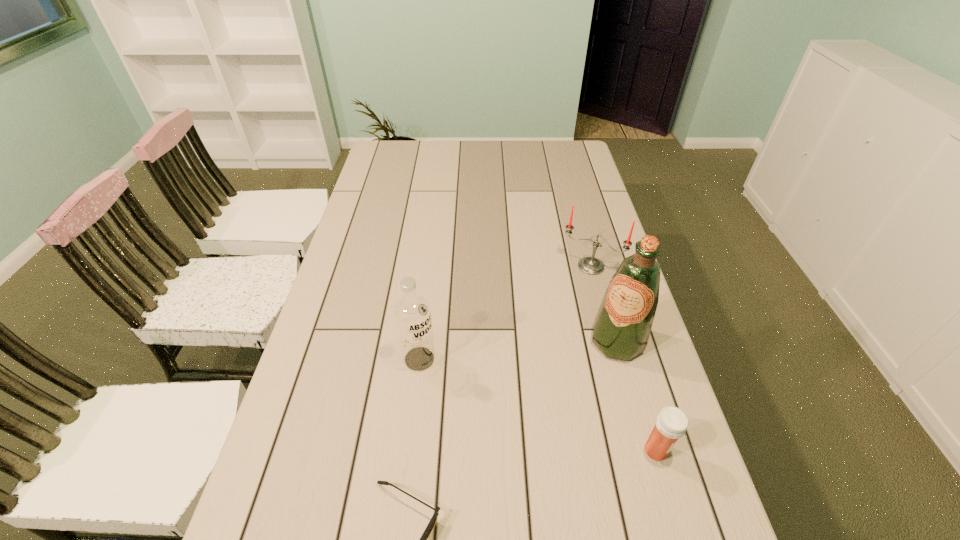
This screenshot has width=960, height=540. I want to click on the fourth farthest object, so click(671, 424).

Locate an element on the screen. The width and height of the screenshot is (960, 540). medicine is located at coordinates (671, 424).

Locate an element on the screen. Image resolution: width=960 pixels, height=540 pixels. olive oil is located at coordinates (622, 326).

At what (x,y) coordinates should I click in order to perform the action: click on the second tallest object. Please return your answer as a coordinate pair (x, y). Looking at the image, I should click on (412, 312).

What are the coordinates of `candle` in the screenshot? It's located at (590, 265).

Where is `the farthest object`? The height and width of the screenshot is (540, 960). the farthest object is located at coordinates (590, 265).

Locate an element on the screen. The image size is (960, 540). vacant space located 0.400m on the front-facing side of the olive oil is located at coordinates pyautogui.click(x=519, y=490).

Identify the location of vacant position located 0.100m on the front-facing side of the olive oil. This screenshot has height=540, width=960. (588, 387).

Find the location of a particular element. The image size is (960, 540). free spot located 0.120m on the front-facing side of the olive oil is located at coordinates (584, 393).

Locate an element on the screen. The height and width of the screenshot is (540, 960). vacant space located on the front label of the second tallest object is located at coordinates (532, 510).